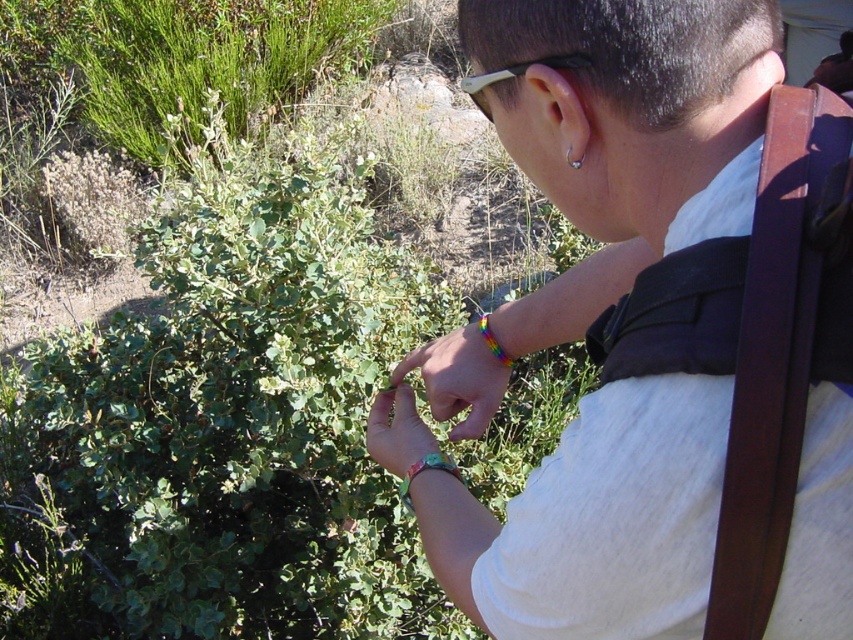
In the scene shown: Is white fabric shirt at upper right wider than rainbow bracelet at center?

Correct, the width of white fabric shirt at upper right exceeds that of rainbow bracelet at center.

Between white fabric shirt at upper right and rainbow bracelet at center, which one is positioned higher?

white fabric shirt at upper right is higher up.

Is point (686, 566) farther from viewer compared to point (496, 336)?

No, (686, 566) is closer to viewer.

This screenshot has width=853, height=640. I want to click on white fabric shirt at upper right, so click(x=662, y=340).

Can you confirm if rainbow bracelet at center is wider than smooth green leaf at center?

Indeed, rainbow bracelet at center has a greater width compared to smooth green leaf at center.

What do you see at coordinates (468, 371) in the screenshot? This screenshot has width=853, height=640. I see `rainbow bracelet at center` at bounding box center [468, 371].

Measure the distance between rainbow bracelet at center and camera.

rainbow bracelet at center and camera are 38.84 inches apart.

The image size is (853, 640). I want to click on rainbow bracelet at center, so click(468, 371).

Does smooth green leaf at center appear under rainbow beaded bracelet at upper right?

Yes.

In order to click on smooth green leaf at center in this screenshot , I will do `click(397, 432)`.

The width and height of the screenshot is (853, 640). What do you see at coordinates (397, 432) in the screenshot?
I see `smooth green leaf at center` at bounding box center [397, 432].

Identify the location of smooth green leaf at center. (397, 432).